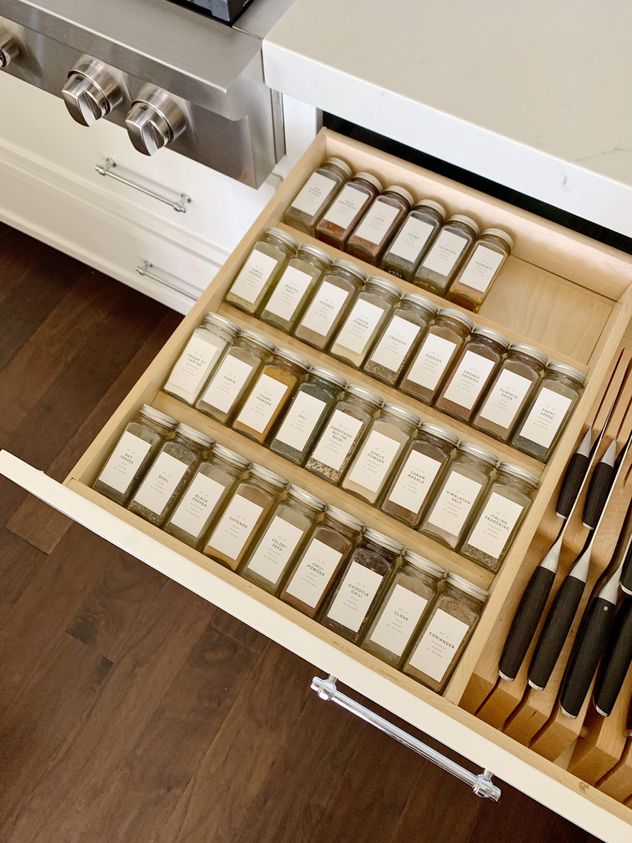
This screenshot has height=843, width=632. I want to click on knife block, so point(543,742).